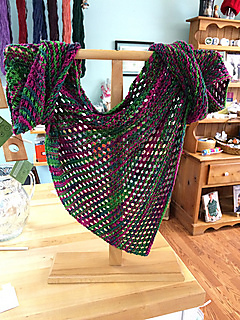
The height and width of the screenshot is (320, 240). Identify the location of crystal vase. (12, 203).